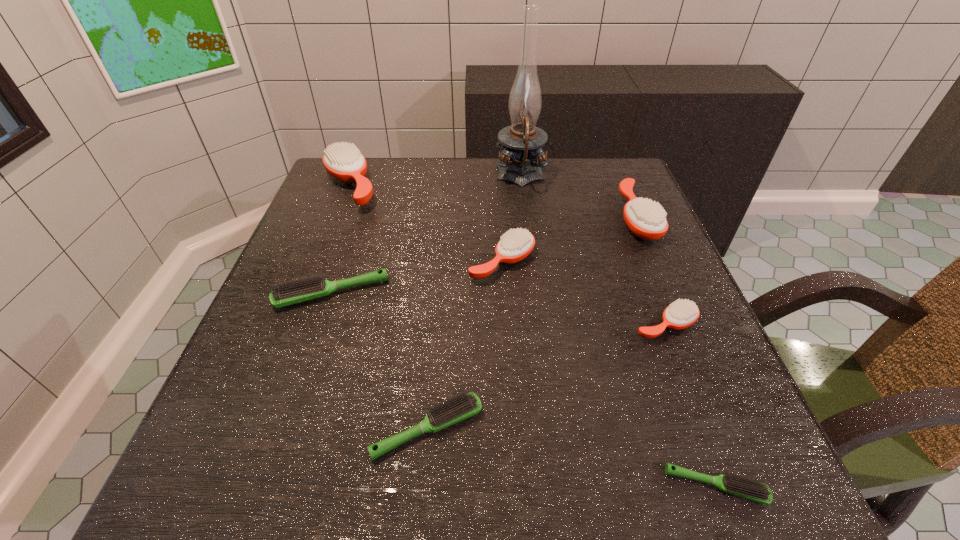
What are the coordinates of `oil lamp` in the screenshot? It's located at (521, 144).

Locate an element on the screen. the biggest orange hairbrush is located at coordinates (344, 162).

Find the location of a particular element. This screenshot has height=540, width=960. the tallest hairbrush is located at coordinates (344, 162).

You are a GUI agent. You are given a task and a screenshot of the screen. Output one action in this format:
    pyautogui.click(x=<x>, y=<y>)
    Task: Click on the sixth shortest hairbrush
    This screenshot has width=960, height=540.
    Given the screenshot: What is the action you would take?
    pyautogui.click(x=646, y=219)

Locate an element on the screen. This screenshot has height=540, width=960. the third smallest orange hairbrush is located at coordinates (646, 219).

Locate an element on the screen. The image size is (960, 540). the fifth shortest hairbrush is located at coordinates (516, 244).

In order to click on the fifth shortest object in this screenshot , I will do `click(516, 244)`.

The image size is (960, 540). Find the location of `the biggest light hairbrush`. the biggest light hairbrush is located at coordinates (287, 293).

The width and height of the screenshot is (960, 540). What are the coordinates of `the farthest light hairbrush` in the screenshot? It's located at (287, 293).

Identify the location of the smallest orange hairbrush. The height and width of the screenshot is (540, 960). (681, 314).